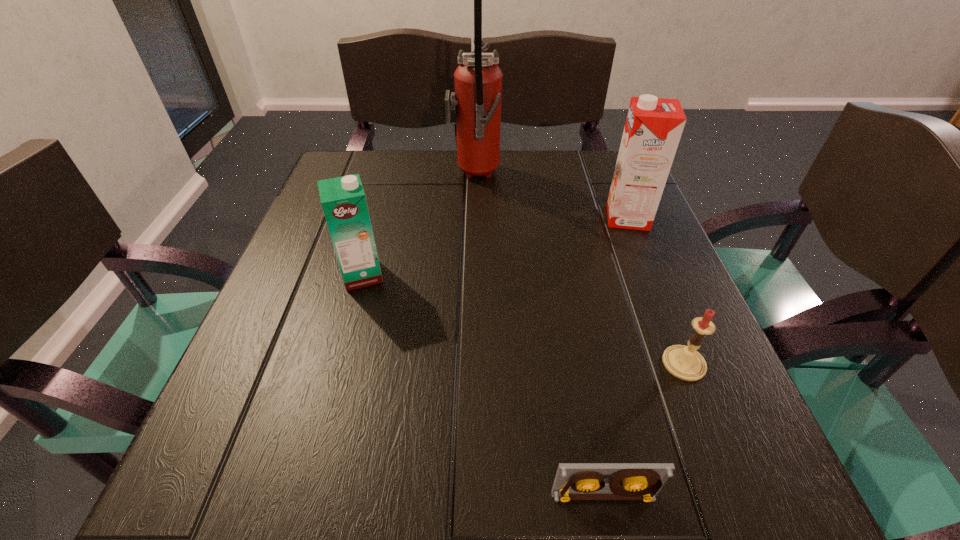
You are a GUI agent. You are given a task and a screenshot of the screen. Output one action in this format:
    pyautogui.click(x=<x>, y=<y>)
    Task: Click on the blank area located at the nozzle of the fire extinguisher
    
    Given the screenshot: What is the action you would take?
    pyautogui.click(x=569, y=177)

Where is `vacant area situated on the front of the fourth shortest object`? The width and height of the screenshot is (960, 540). vacant area situated on the front of the fourth shortest object is located at coordinates (678, 341).

Where is `vacant space located on the left of the third nearest object`? The height and width of the screenshot is (540, 960). vacant space located on the left of the third nearest object is located at coordinates (302, 275).

The height and width of the screenshot is (540, 960). I want to click on free space located 0.120m on the back of the candle, so click(x=656, y=293).

Find the location of `object present at the far edge`. object present at the far edge is located at coordinates (478, 80).

The width and height of the screenshot is (960, 540). I want to click on object at the near edge, so click(x=574, y=481).

This screenshot has width=960, height=540. Identify the location of object that is at the left edge. (343, 200).

Locate an element on the screen. The width and height of the screenshot is (960, 540). carton that is at the right edge is located at coordinates (653, 128).

This screenshot has height=540, width=960. In order to click on candle present at the right edge in this screenshot , I will do `click(684, 362)`.

I want to click on videotape that is at the right edge, so click(x=574, y=481).